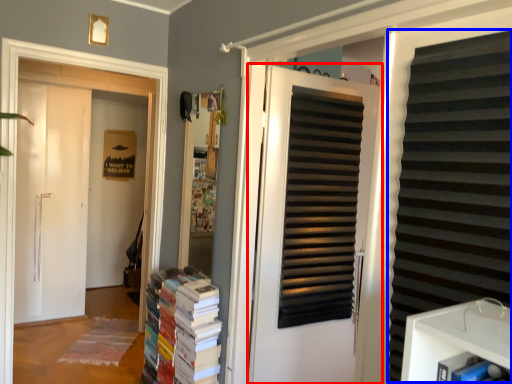
Question: Among these objects, which one is farthest to the camera, door (highlighted by a red box) or shutter (highlighted by a blue box)?

Choices:
 (A) door
 (B) shutter

Answer: (A)